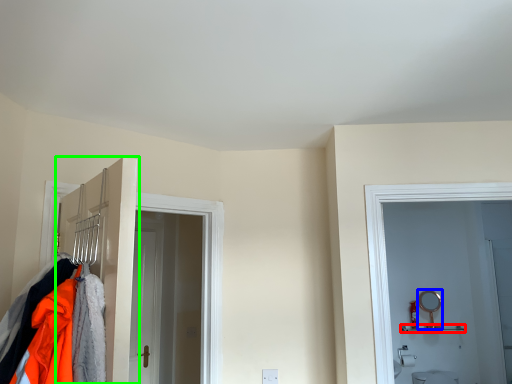
Question: Based on their relative distances, which object is nearer to shelf (highlighted by a red box)? Choose from mirror (highlighted by a blue box) and door (highlighted by a green box).

Choices:
 (A) mirror
 (B) door

Answer: (A)